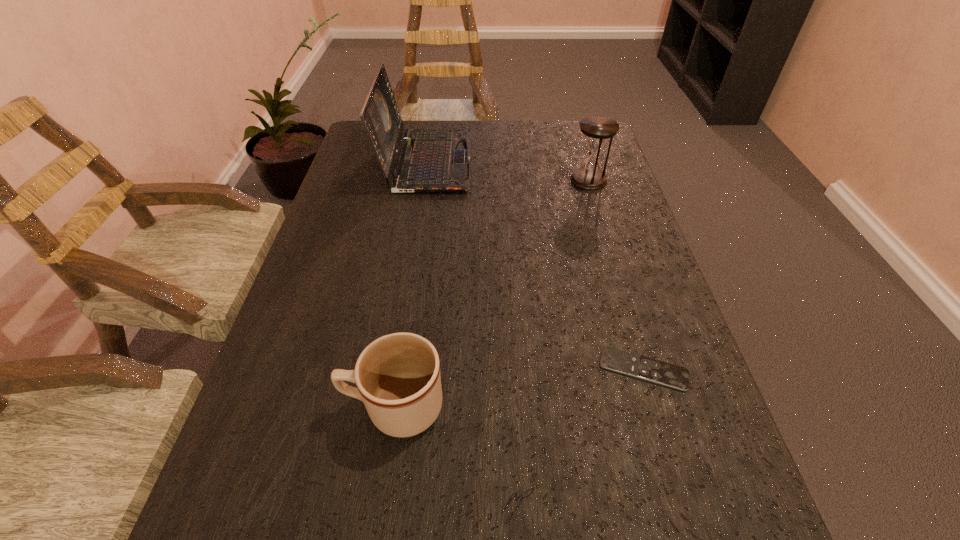
Where is `blank space that satisfies the following two spatial constraints: 1. on the side of the third tallest object with the handle; 2. on the left side of the hourglass`? This screenshot has height=540, width=960. blank space that satisfies the following two spatial constraints: 1. on the side of the third tallest object with the handle; 2. on the left side of the hourglass is located at coordinates (427, 180).

What are the coordinates of `blank space that satisfies the following two spatial constraints: 1. on the screen of the laptop computer; 2. on the side of the mug with the handle` in the screenshot? It's located at (390, 407).

The image size is (960, 540). Identify the location of free space that satisfies the following two spatial constraints: 1. on the side of the mug with the handle; 2. on the left side of the remote control. (400, 369).

I want to click on vacant area in the image that satisfies the following two spatial constraints: 1. on the side of the remote control with the handle; 2. on the left side of the third tallest object, so click(400, 369).